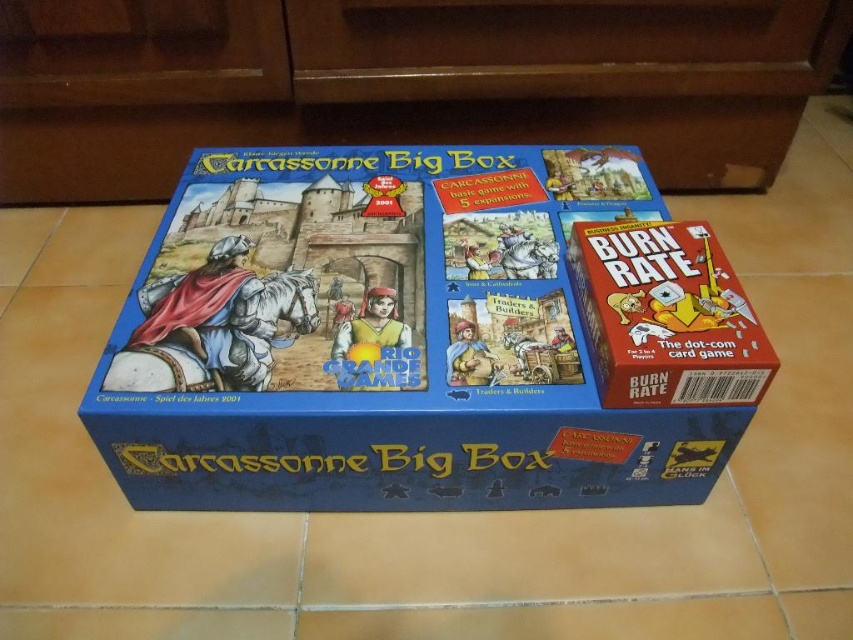
You are organizing a game night and need to place the blue cardboard carcassonne big box at center and the matte cardboard box at right on a shelf. If the shelf has enough space, which box should you place first to ensure both fit properly?

The blue cardboard carcassonne big box at center is positioned on the left side of matte cardboard box at right, so you should place the blue cardboard carcassonne big box at center first on the left side of the shelf to accommodate the matte cardboard box at right on its right side.

You are organizing board games on a shelf and need to place both the blue cardboard carcassonne big box at center and the matte cardboard box at right. The shelf has a height limit of 15 cm. Can you determine if both boxes will fit vertically side by side on the shelf?

The blue cardboard carcassonne big box at center is larger in size than the matte cardboard box at right. However, the exact height of each box isn